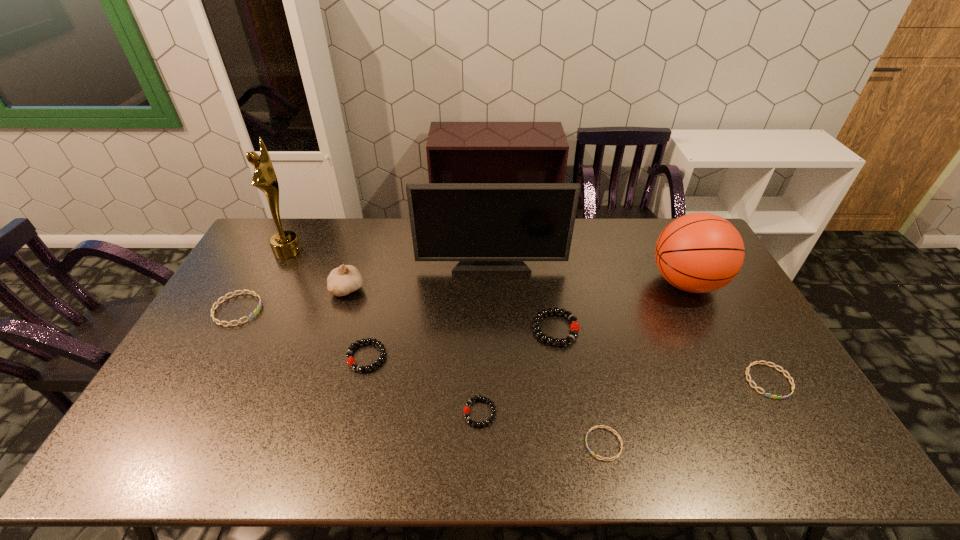
The image size is (960, 540). Identify the location of vacant space that's between the leftmost black bracelet and the leftmost blue bracelet. (302, 333).

Where is `free spot between the black monitor and the third bracelet from left to right`? free spot between the black monitor and the third bracelet from left to right is located at coordinates (486, 339).

At what (x,y) coordinates should I click in order to perform the action: click on vacant area that lies between the nearest blue bracelet and the smallest black bracelet. Please return your answer as a coordinate pair (x, y). Looking at the image, I should click on (541, 428).

Select which object is the third closest to the seventh object from right to left. Please provide its 2D coordinates. Your answer should be formatted as a tuple, i.e. [(x, y)], where the tuple contains the x and y coordinates of a point satisfying the conditions above.

[(490, 228)]

Locate an element on the screen. This screenshot has width=960, height=540. object that is the ninth closest one to the farthest blue bracelet is located at coordinates click(750, 381).

Locate an element on the screen. This screenshot has width=960, height=540. the third closest bracelet to the rightmost black bracelet is located at coordinates (350, 360).

Identify which bracelet is the fifth nearest to the garlic. Please provide its 2D coordinates. Your answer should be formatted as a tuple, i.e. [(x, y)], where the tuple contains the x and y coordinates of a point satisfying the conditions above.

[(615, 457)]

The height and width of the screenshot is (540, 960). What are the coordinates of `black bracelet that can be found as the closest to the leftmost bracelet` in the screenshot? It's located at (350, 360).

The image size is (960, 540). What are the coordinates of `the second closest black bracelet to the second bracelet from left to right` in the screenshot? It's located at (573, 319).

What are the coordinates of `blue bracelet identified as the closest to the leftmost bracelet` in the screenshot? It's located at (615, 457).